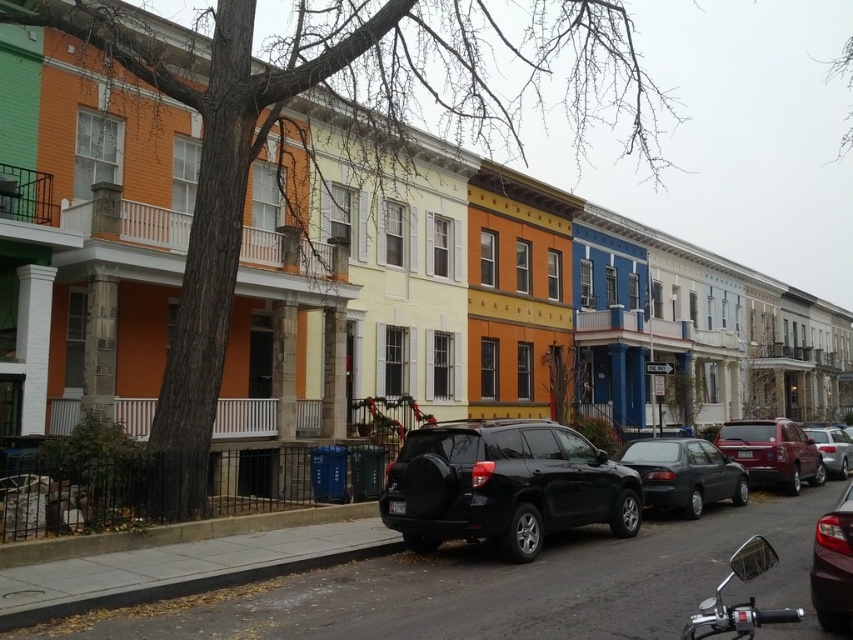
Question: Is black matte suv at center bigger than matte black sedan at center?

Choices:
 (A) no
 (B) yes

Answer: (B)

Question: From the image, what is the correct spatial relationship of black matte suv at center in relation to metallic silver sedan at right?

Choices:
 (A) left
 (B) right

Answer: (A)

Question: Estimate the real-world distances between objects in this image. Which object is farther from the shiny dark red sedan at lower right?

Choices:
 (A) metallic silver sedan at right
 (B) black matte suv at center
 (C) shiny chrome mirror at lower right

Answer: (A)

Question: Which point appears closest to the camera in this image?

Choices:
 (A) (814, 429)
 (B) (751, 454)
 (C) (432, 483)

Answer: (C)

Question: Considering the relative positions of black matte suv at center and matte black sedan at center in the image provided, where is black matte suv at center located with respect to matte black sedan at center?

Choices:
 (A) right
 (B) left

Answer: (B)

Question: Which point is farther from the camera taking this photo?

Choices:
 (A) (694, 468)
 (B) (782, 474)
 (C) (492, 496)
 (D) (767, 566)

Answer: (B)